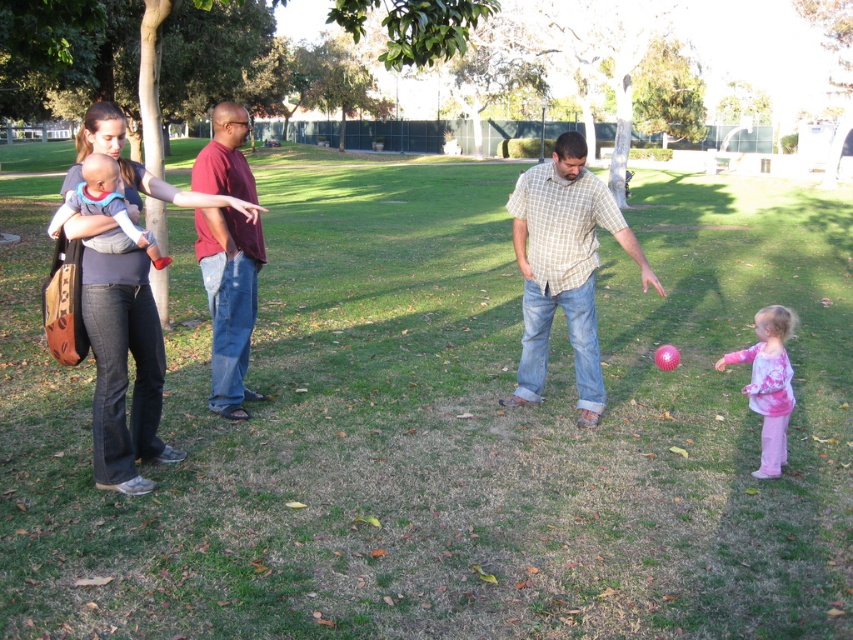
Question: Which object is farther from the camera taking this photo?

Choices:
 (A) pink cotton shirt at lower right
 (B) matte gray baby at left
 (C) matte black shirt at upper left
 (D) checkered shirt jeans at center

Answer: (D)

Question: Does matte black shirt at upper left come behind pink cotton shirt at lower right?

Choices:
 (A) no
 (B) yes

Answer: (A)

Question: Estimate the real-world distances between objects in this image. Which object is closer to the checkered shirt jeans at center?

Choices:
 (A) maroon t-shirt at center
 (B) pink cotton shirt at lower right
 (C) matte black shirt at upper left

Answer: (B)

Question: Which of the following is the closest to the observer?

Choices:
 (A) (238, 106)
 (B) (590, 310)
 (C) (119, 205)
 (D) (125, 477)

Answer: (C)

Question: From the image, what is the correct spatial relationship of checkered shirt jeans at center in relation to maroon t-shirt at center?

Choices:
 (A) above
 (B) below

Answer: (B)

Question: Does matte black shirt at upper left have a greater width compared to maroon t-shirt at center?

Choices:
 (A) yes
 (B) no

Answer: (A)